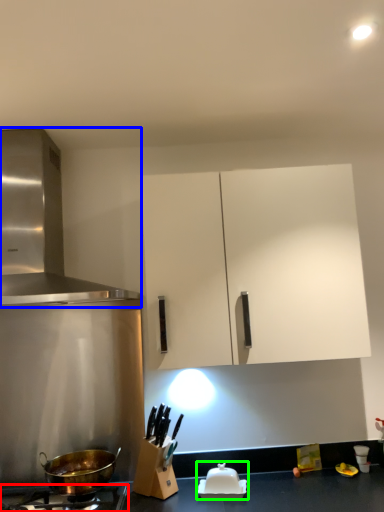
Question: Considering the real-world distances, which object is farthest from gas stove (highlighted by a red box)? kitchen appliance (highlighted by a blue box) or appliance (highlighted by a green box)?

Choices:
 (A) kitchen appliance
 (B) appliance

Answer: (A)